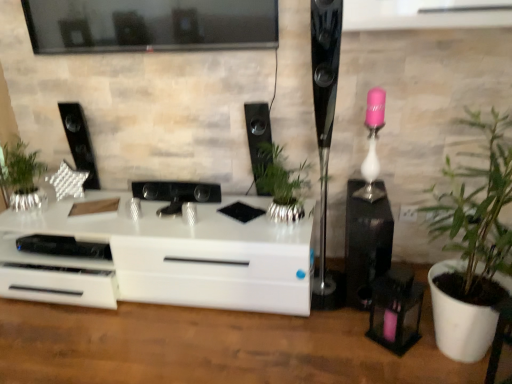
In order to click on vacant area that is in front of polished black speaker at right, the third speaker viewed from the left in this screenshot , I will do `click(323, 327)`.